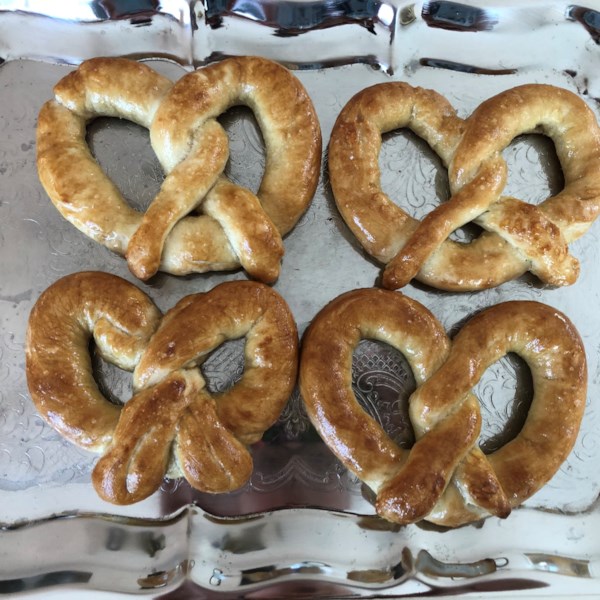
You are a GUI agent. You are given a task and a screenshot of the screen. Output one action in this format:
    pyautogui.click(x=<x>, y=<y>)
    Task: Click on the reflections of room on tray
    This screenshot has height=600, width=600.
    Given the screenshot: What is the action you would take?
    pyautogui.click(x=123, y=10), pyautogui.click(x=300, y=15), pyautogui.click(x=467, y=20), pyautogui.click(x=591, y=14)